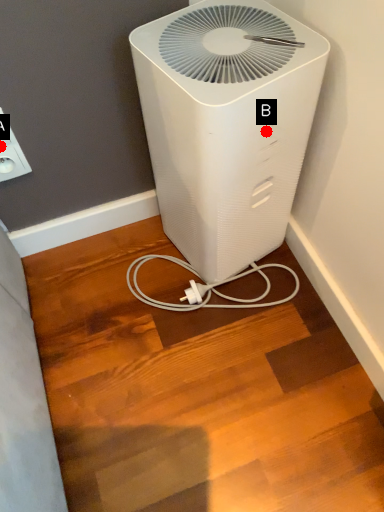
Question: Two points are circled on the image, labeled by A and B beside each circle. Which point is further to the camera?

Choices:
 (A) A is further
 (B) B is further

Answer: (A)